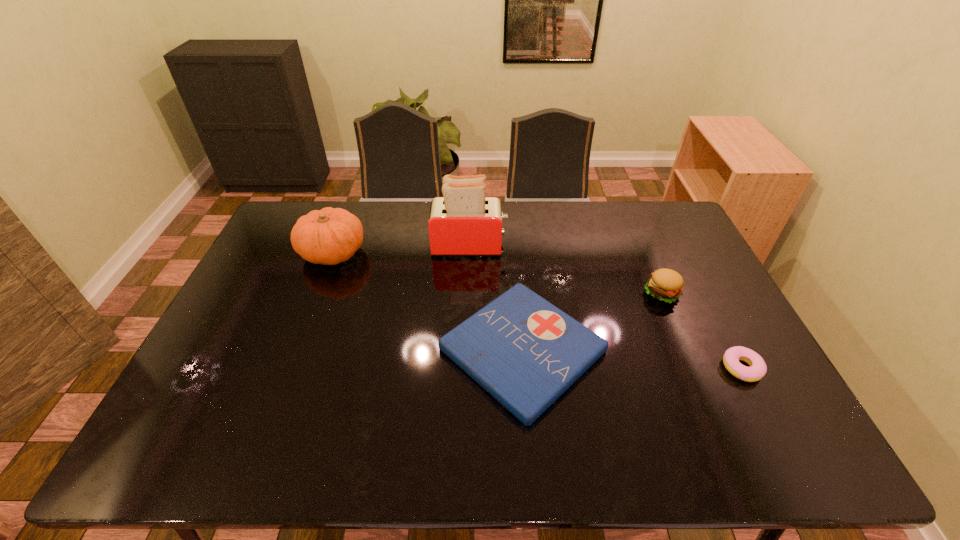
Image resolution: width=960 pixels, height=540 pixels. I want to click on free spot at the left edge of the desktop, so click(x=295, y=260).

Locate an element on the screen. vacant region at the right edge of the desktop is located at coordinates (704, 286).

In the image, there is a desktop. Identify the location of vacant space at the far left corner. This screenshot has width=960, height=540. (290, 203).

Find the location of a particular element. vacant space at the far right corner is located at coordinates (684, 226).

Find the location of a particular element. This screenshot has height=540, width=960. free space at the near right corner is located at coordinates (753, 454).

Locate an element on the screen. The width and height of the screenshot is (960, 540). empty location between the first-aid kit and the leftmost object is located at coordinates (428, 301).

This screenshot has width=960, height=540. Find the location of `empty location between the rightmost object and the third tallest object`. empty location between the rightmost object and the third tallest object is located at coordinates (702, 330).

I want to click on vacant space that is in between the first-aid kit and the hamburger, so click(x=591, y=321).

The height and width of the screenshot is (540, 960). I want to click on free space between the toaster and the hamburger, so [565, 269].

Locate an element on the screen. The height and width of the screenshot is (540, 960). free space between the tallest object and the leftmost object is located at coordinates (401, 249).